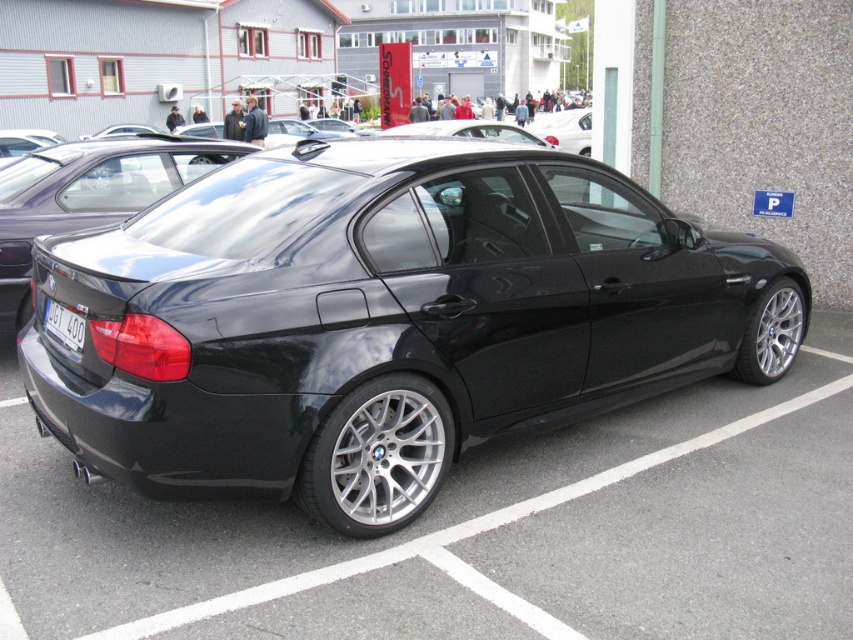
Question: Based on their relative distances, which object is farther from the glossy black car at center?

Choices:
 (A) black metallic sedan at center
 (B) glossy black sedan at center
 (C) white plastic license plate at rear

Answer: (B)

Question: Which point is farther to the camera?

Choices:
 (A) (13, 204)
 (B) (405, 451)
 (C) (80, 323)

Answer: (A)

Question: Which point is closer to the camera?

Choices:
 (A) (637, 456)
 (B) (207, 157)
 (C) (189, 460)
 (D) (57, 317)

Answer: (C)

Question: Observing the image, what is the correct spatial positioning of black metallic sedan at center in reference to white plastic license plate at rear?

Choices:
 (A) above
 (B) below

Answer: (A)

Question: Can you confirm if black metallic sedan at center is wider than glossy black sedan at center?

Choices:
 (A) no
 (B) yes

Answer: (B)

Question: Does black metallic sedan at center come behind glossy black sedan at center?

Choices:
 (A) no
 (B) yes

Answer: (A)